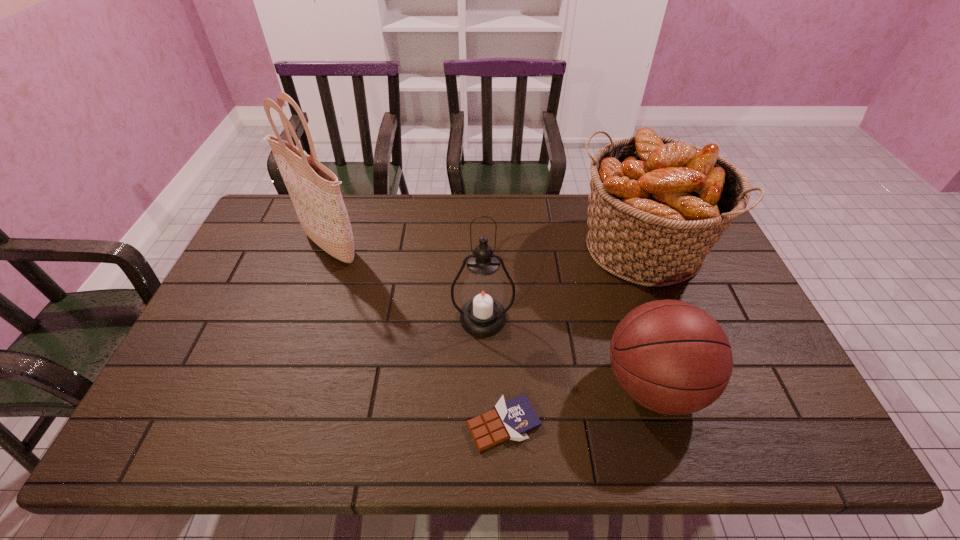
At what (x,y) coordinates should I click in order to perform the action: click on vacant space at the near edge. Please return your answer as a coordinate pair (x, y). The image size is (960, 540). Looking at the image, I should click on (608, 424).

Identify the location of vacant space at the left edge. The height and width of the screenshot is (540, 960). (252, 275).

This screenshot has height=540, width=960. I want to click on vacant region at the right edge, so click(x=712, y=262).

At what (x,y) coordinates should I click in order to perform the action: click on vacant space at the far left corner of the desktop. Please return your answer as a coordinate pair (x, y). This screenshot has width=960, height=540. Looking at the image, I should click on (276, 202).

In order to click on vacant region at the near right corner of the desktop in this screenshot , I will do `click(776, 451)`.

Identify the location of unoccupied area between the third farthest object and the chocolate bar. (493, 371).

Find the location of a particular element. This screenshot has width=960, height=540. vacant space that's between the oil lamp and the shopping bag is located at coordinates (405, 282).

This screenshot has width=960, height=540. In order to click on unoccupied position between the basketball and the shortest object in this screenshot , I will do `click(578, 405)`.

You are a GUI agent. You are given a task and a screenshot of the screen. Output one action in this format:
    pyautogui.click(x=<x>, y=<y>)
    Task: Click on the vacant region between the shortest object and the shopping bag
    The image size is (960, 540).
    Given the screenshot: What is the action you would take?
    pyautogui.click(x=416, y=335)

I want to click on free space between the third farthest object and the fourth tallest object, so click(x=568, y=352).